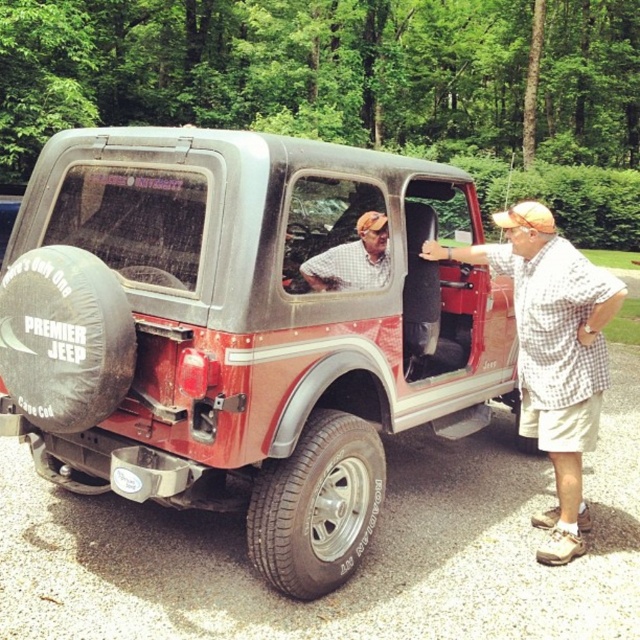
Who is positioned more to the left, rustic metal pickup truck at center or checkered fabric shirt at center?

checkered fabric shirt at center

Who is more forward, (186,426) or (387,280)?

Point (186,426)

Between point (228, 422) and point (372, 244), which one is positioned in front?

Point (228, 422) is more forward.

Where is `rustic metal pickup truck at center`? This screenshot has height=640, width=640. rustic metal pickup truck at center is located at coordinates (241, 332).

Is point (417, 396) farther from viewer compared to point (307, 467)?

Yes, point (417, 396) is farther from viewer.

Which is behind, point (122, 220) or point (344, 554)?

The point (344, 554) is behind.

Who is more distant from viewer, (396, 216) or (323, 481)?

Positioned behind is point (396, 216).

Locate an element on the screen. The image size is (640, 640). rustic metal pickup truck at center is located at coordinates (241, 332).

Does checkered fabric shirt at right appear under black rubber tire at lower center?

No.

Does checkered fabric shirt at right appear on the right side of black rubber tire at lower center?

Indeed, checkered fabric shirt at right is positioned on the right side of black rubber tire at lower center.

At what (x,y) coordinates should I click in order to perform the action: click on checkered fabric shirt at right. Please return your answer as a coordinate pair (x, y). Looking at the image, I should click on (x=552, y=353).

Image resolution: width=640 pixels, height=640 pixels. I want to click on checkered fabric shirt at right, so click(552, 353).